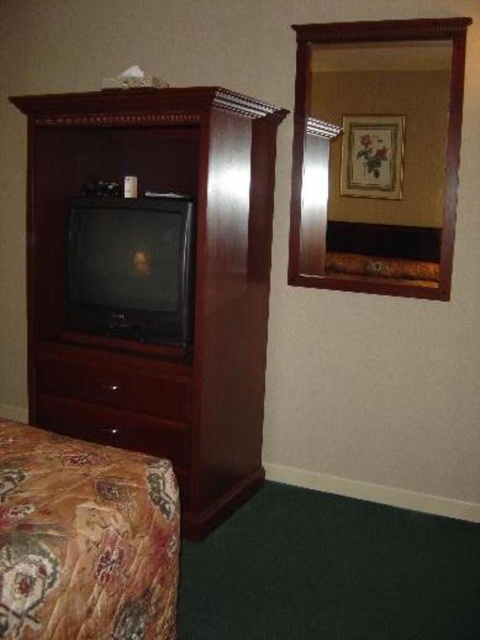
From the picture: You are standing in the center of the room and want to place a new clock on the mahogany wood dresser at left. Based on its current position, which direction should you walk to reach it?

The mahogany wood dresser at left is located at point (190, 284), so you should walk to the left to reach it.